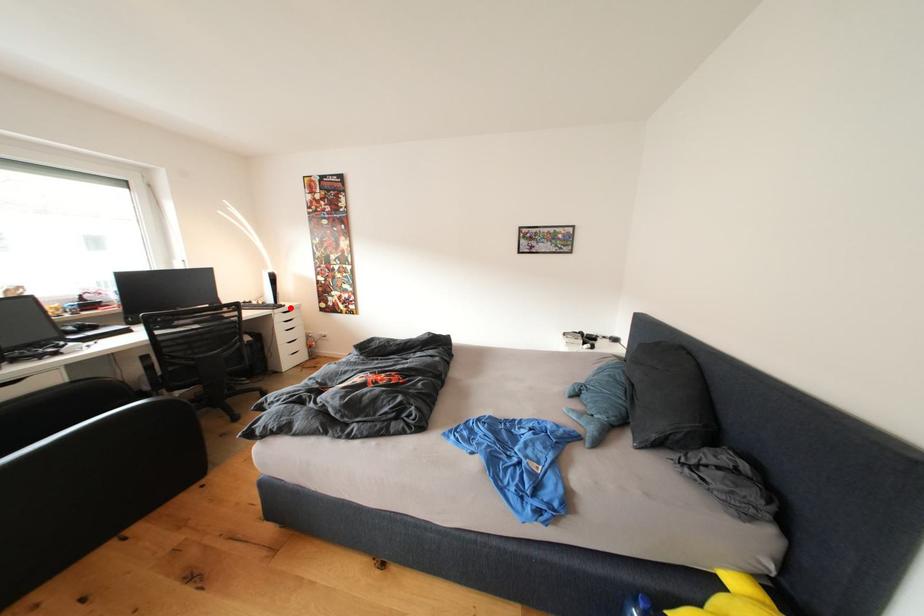
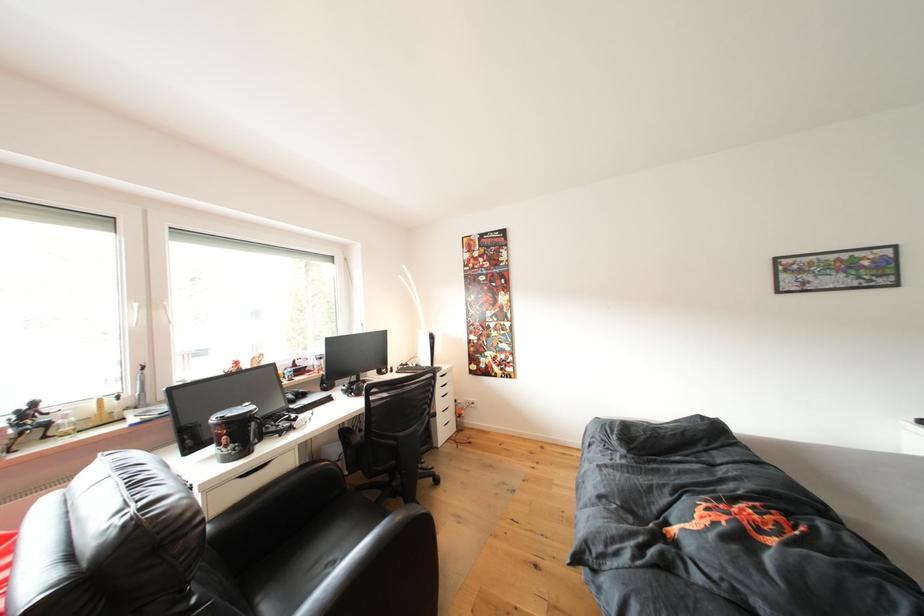
In the second image, find the point that corresponds to the highlighted location in the first image.

(444, 370)